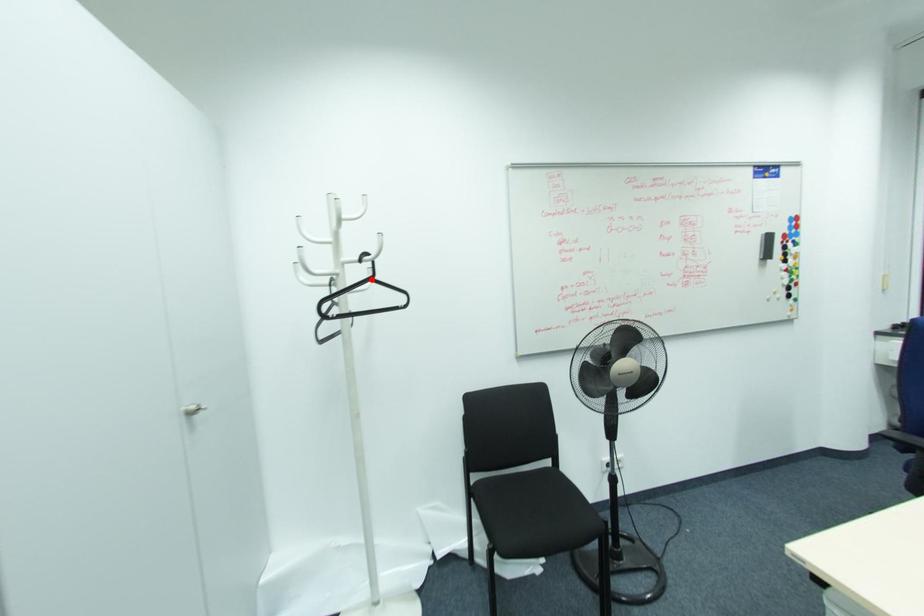
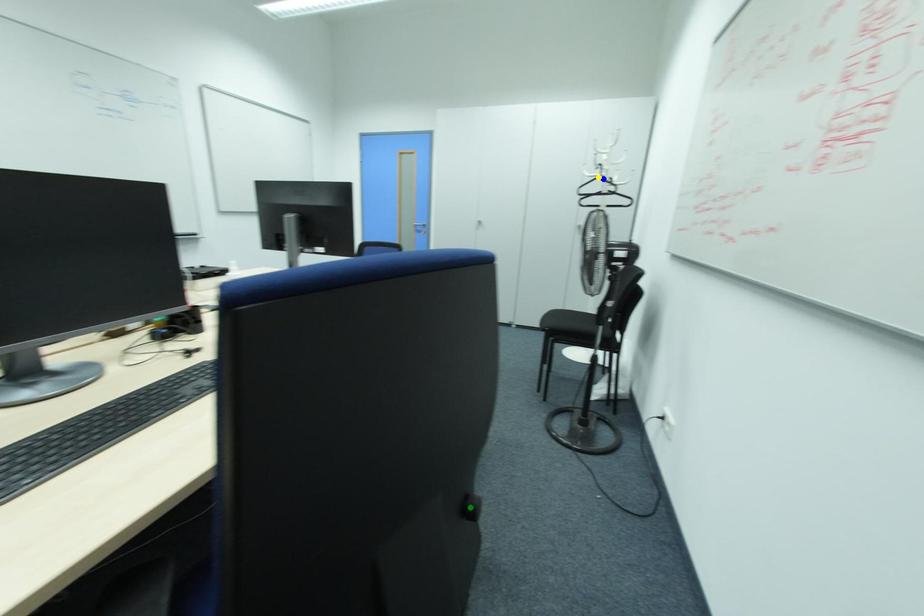
Question: I am providing you with two images of the same scene from different viewpoints. A red point is marked on the first image. You are given multiple points on the second image. Which point in image 2 represents the same 3d spot as the red point in image 1?

Choices:
 (A) green point
 (B) blue point
 (C) yellow point

Answer: (C)